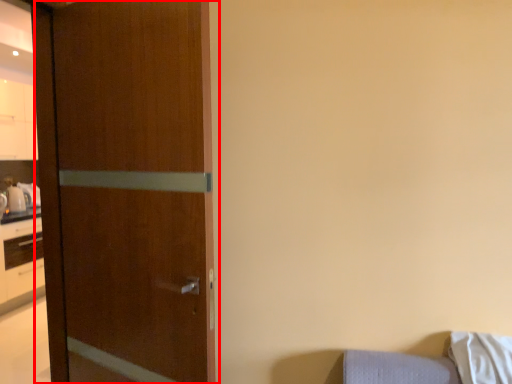
Question: From the image's perspective, where is door (annotated by the red box) located relative to pillow?

Choices:
 (A) above
 (B) below

Answer: (A)